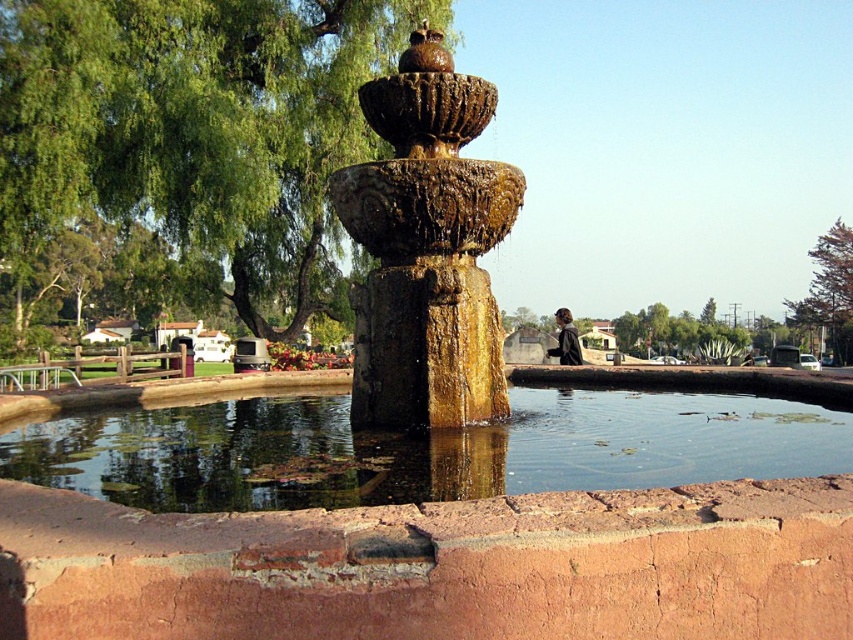
You are standing near the stone fountain and looking towards the green leafy tree at upper left and the clear water at fountain center. Which object appears taller from your perspective?

The green leafy tree at upper left appears taller than the clear water at fountain center because it has a greater height compared to the clear water at fountain center.

You are standing at the center of the image and want to locate the clear water at fountain center. Which direction should you move to reach it?

The clear water at fountain center is located at point 0.703 on the x axis and 0.492 on the y axis. Since you are at the center of the image, you should move right along the x axis and slightly down along the y axis to reach it.